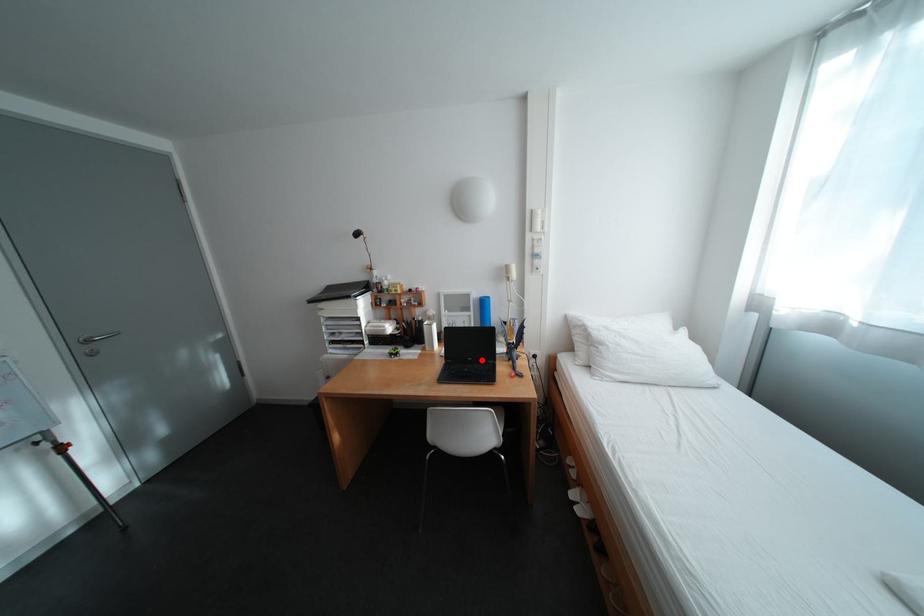
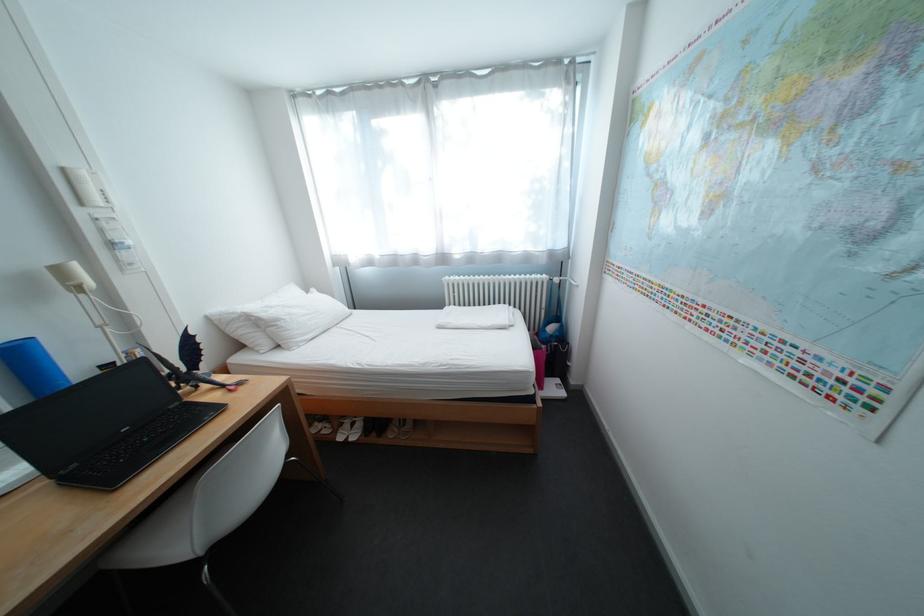
Where in the second image is the point corresponding to the highlighted location from the first image?

(137, 431)